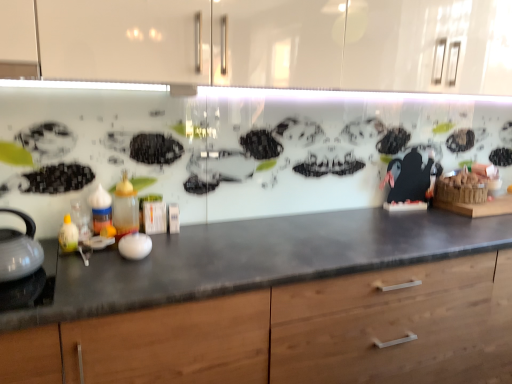
The height and width of the screenshot is (384, 512). What do you see at coordinates (294, 333) in the screenshot?
I see `wooden cabinet at center` at bounding box center [294, 333].

Measure the distance between translucent plastic bottle at left, the second bottle from the right, and camera.

translucent plastic bottle at left, the second bottle from the right, and camera are 1.53 meters apart from each other.

Find the location of a particular element. The image size is (512, 384). translucent plastic bottle at center, which is the 2th bottle from left to right is located at coordinates (125, 208).

From the image's perspective, starting from the wooden cabinet at center, which bottle is the 2nd one above? Please provide its 2D coordinates.

[(125, 208)]

Is wooden cabinet at center surrounding translucent plastic bottle at center, which is the 1th bottle from right to left?

Actually, translucent plastic bottle at center, which is the 1th bottle from right to left, is outside wooden cabinet at center.

Is point (113, 315) closer to camera compared to point (114, 205)?

Yes, point (113, 315) is in front of point (114, 205).

Considering the positions of objects wooden cabinet at center and translucent plastic bottle at center, which is the 1th bottle from right to left, in the image provided, who is behind, wooden cabinet at center or translucent plastic bottle at center, which is the 1th bottle from right to left,?

translucent plastic bottle at center, which is the 1th bottle from right to left, is more distant.

Is white glossy tea pot at left beside translucent plastic bottle at left, placed as the 1th bottle when sorted from left to right?

No.

Is white glossy tea pot at left inside or outside of translucent plastic bottle at left, placed as the 1th bottle when sorted from left to right?

white glossy tea pot at left is not inside translucent plastic bottle at left, placed as the 1th bottle when sorted from left to right, it's outside.

Relative to translucent plastic bottle at left, placed as the 1th bottle when sorted from left to right, is white glossy tea pot at left in front or behind?

Visually, white glossy tea pot at left is located in front of translucent plastic bottle at left, placed as the 1th bottle when sorted from left to right.

Considering the sizes of objects translucent plastic bottle at center, which is the 2th bottle from left to right, and translucent plastic bottle at left, placed as the 1th bottle when sorted from left to right, in the image provided, who is taller, translucent plastic bottle at center, which is the 2th bottle from left to right, or translucent plastic bottle at left, placed as the 1th bottle when sorted from left to right,?

translucent plastic bottle at center, which is the 2th bottle from left to right, is taller.

From the picture: Considering the relative sizes of translucent plastic bottle at center, which is the 1th bottle from right to left, and translucent plastic bottle at left, placed as the 1th bottle when sorted from left to right, in the image provided, is translucent plastic bottle at center, which is the 1th bottle from right to left, smaller than translucent plastic bottle at left, placed as the 1th bottle when sorted from left to right,?

No.

How far apart are translucent plastic bottle at center, which is the 2th bottle from left to right, and translucent plastic bottle at left, the second bottle from the right?

translucent plastic bottle at center, which is the 2th bottle from left to right, and translucent plastic bottle at left, the second bottle from the right, are 5.95 centimeters apart.

Looking at this image, which is farther from the camera, (135, 201) or (95, 233)?

Positioned behind is point (135, 201).

From the image's perspective, which is above, wooden cabinet at center or translucent plastic bottle at left, placed as the 1th bottle when sorted from left to right?

translucent plastic bottle at left, placed as the 1th bottle when sorted from left to right, appears higher in the image.

What's the angular difference between wooden cabinet at center and translucent plastic bottle at left, placed as the 1th bottle when sorted from left to right,'s facing directions?

The angle between the facing direction of wooden cabinet at center and the facing direction of translucent plastic bottle at left, placed as the 1th bottle when sorted from left to right, is 0.145 degrees.

Is wooden cabinet at center positioned with its back to translucent plastic bottle at left, the second bottle from the right?

No, translucent plastic bottle at left, the second bottle from the right, is not at the back of wooden cabinet at center.

Between wooden cabinet at center and translucent plastic bottle at left, the second bottle from the right, which one has more height?

With more height is wooden cabinet at center.

Do you think translucent plastic bottle at left, the second bottle from the right, is within wooden cabinet at center, or outside of it?

translucent plastic bottle at left, the second bottle from the right, is outside wooden cabinet at center.

Which object is positioned more to the left, translucent plastic bottle at left, the second bottle from the right, or wooden cabinet at center?

Positioned to the left is translucent plastic bottle at left, the second bottle from the right.

Considering the sizes of translucent plastic bottle at left, placed as the 1th bottle when sorted from left to right, and wooden cabinet at center in the image, is translucent plastic bottle at left, placed as the 1th bottle when sorted from left to right, taller or shorter than wooden cabinet at center?

In the image, translucent plastic bottle at left, placed as the 1th bottle when sorted from left to right, appears to be shorter than wooden cabinet at center.

Is translucent plastic bottle at left, placed as the 1th bottle when sorted from left to right, far away from wooden cabinet at center?

No.

From the picture: Is the surface of translucent plastic bottle at center, which is the 2th bottle from left to right, in direct contact with wooden cabinet at center?

translucent plastic bottle at center, which is the 2th bottle from left to right, is not next to wooden cabinet at center, and they're not touching.

Is point (121, 220) positioned before point (16, 349)?

No, (121, 220) is behind (16, 349).

Considering their positions, is translucent plastic bottle at center, which is the 2th bottle from left to right, located in front of or behind wooden cabinet at center?

Clearly, translucent plastic bottle at center, which is the 2th bottle from left to right, is behind wooden cabinet at center.

Image resolution: width=512 pixels, height=384 pixels. In order to click on cabinetry located on the right of translucent plastic bottle at center, which is the 2th bottle from left to right in this screenshot , I will do `click(294, 333)`.

Which is in front, point (103, 226) or point (129, 214)?

The point (103, 226) is in front.

From the image's perspective, which object appears higher, translucent plastic bottle at left, placed as the 1th bottle when sorted from left to right, or translucent plastic bottle at center, which is the 2th bottle from left to right?

translucent plastic bottle at center, which is the 2th bottle from left to right.

Does translucent plastic bottle at left, placed as the 1th bottle when sorted from left to right, contain translucent plastic bottle at center, which is the 2th bottle from left to right?

No.

Locate an element on the screen. cabinetry below the translucent plastic bottle at center, which is the 1th bottle from right to left (from a real-world perspective) is located at coordinates (294, 333).

In order to click on the 1st bottle counting from the right of the white glossy tea pot at left in this screenshot , I will do `click(100, 209)`.

Which object lies further to the anchor point translucent plastic bottle at center, which is the 2th bottle from left to right, white glossy tea pot at left or wooden cabinet at center?

wooden cabinet at center.

When comparing their distances from translucent plastic bottle at left, placed as the 1th bottle when sorted from left to right, does wooden cabinet at center or translucent plastic bottle at center, which is the 1th bottle from right to left, seem further?

Among the two, wooden cabinet at center is located further to translucent plastic bottle at left, placed as the 1th bottle when sorted from left to right.

Estimate the real-world distances between objects in this image. Which object is further from white glossy tea pot at left, translucent plastic bottle at left, the second bottle from the right, or translucent plastic bottle at center, which is the 2th bottle from left to right?

translucent plastic bottle at center, which is the 2th bottle from left to right, is further to white glossy tea pot at left.

Estimate the real-world distances between objects in this image. Which object is closer to translucent plastic bottle at center, which is the 2th bottle from left to right, wooden cabinet at center or white glossy tea pot at left?

white glossy tea pot at left.

Based on their spatial positions, is white glossy tea pot at left or translucent plastic bottle at left, the second bottle from the right, further from translucent plastic bottle at center, which is the 2th bottle from left to right?

Based on the image, white glossy tea pot at left appears to be further to translucent plastic bottle at center, which is the 2th bottle from left to right.

Based on their spatial positions, is translucent plastic bottle at left, the second bottle from the right, or white glossy tea pot at left closer to wooden cabinet at center?

white glossy tea pot at left is closer to wooden cabinet at center.

Looking at the image, which one is located further to translucent plastic bottle at center, which is the 1th bottle from right to left, translucent plastic bottle at left, the second bottle from the right, or wooden cabinet at center?

wooden cabinet at center is positioned further to the anchor translucent plastic bottle at center, which is the 1th bottle from right to left.

Based on their spatial positions, is white glossy tea pot at left or translucent plastic bottle at center, which is the 2th bottle from left to right, further from wooden cabinet at center?

Among the two, translucent plastic bottle at center, which is the 2th bottle from left to right, is located further to wooden cabinet at center.

You are a GUI agent. You are given a task and a screenshot of the screen. Output one action in this format:
    pyautogui.click(x=<x>, y=<y>)
    Task: Click on the bottle located between translucent plastic bottle at left, placed as the 1th bottle when sorted from left to right, and wooden cabinet at center in the left-right direction
    This screenshot has height=384, width=512.
    Given the screenshot: What is the action you would take?
    pyautogui.click(x=125, y=208)

Where is `bottle positioned between white glossy tea pot at left and translucent plastic bottle at center, which is the 2th bottle from left to right, from near to far`? This screenshot has width=512, height=384. bottle positioned between white glossy tea pot at left and translucent plastic bottle at center, which is the 2th bottle from left to right, from near to far is located at coordinates (100, 209).